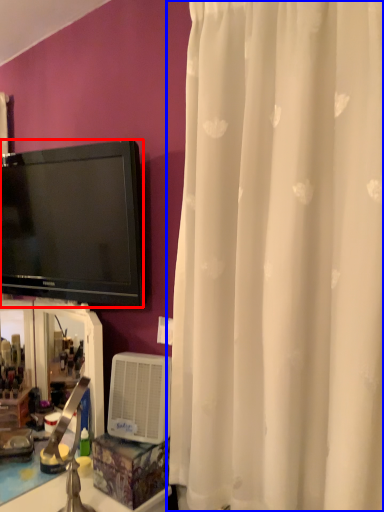
Question: Which object is further to the camera taking this photo, television (highlighted by a red box) or curtain (highlighted by a blue box)?

Choices:
 (A) television
 (B) curtain

Answer: (A)